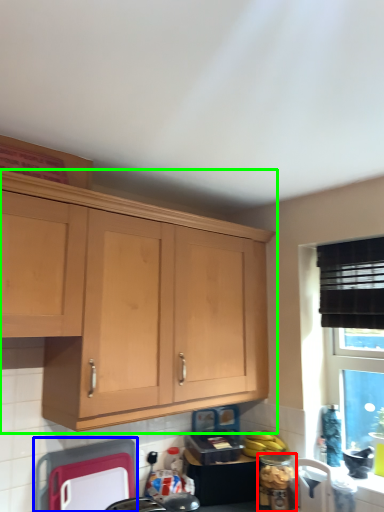
Question: Which is nearer to the appliance (highlighted by a red box)? appliance (highlighted by a blue box) or cabinetry (highlighted by a green box).

Choices:
 (A) appliance
 (B) cabinetry

Answer: (A)